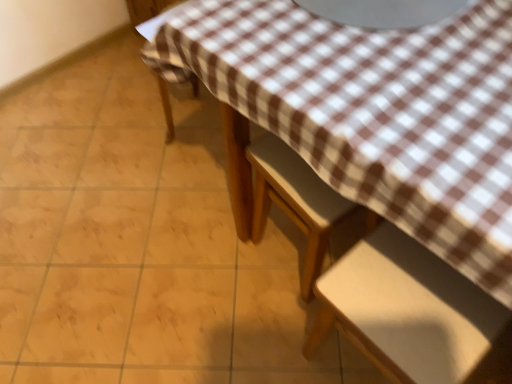
Identify the location of free point above brown checkered tablecloth at upper center (from a real-world perspective). The width and height of the screenshot is (512, 384). (144, 245).